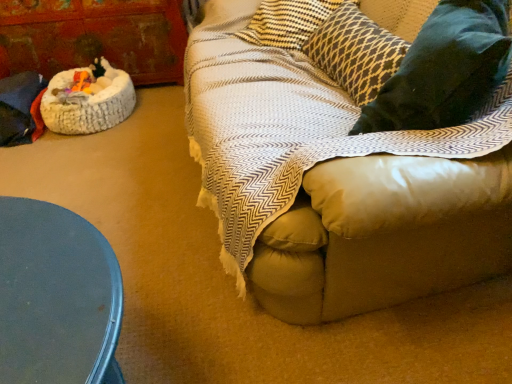
Question: Does dark gray textured pillow at upper right appear on the right side of white fluffy cat bed at left?

Choices:
 (A) yes
 (B) no

Answer: (A)

Question: Does dark gray textured pillow at upper right have a smaller size compared to white fluffy cat bed at left?

Choices:
 (A) no
 (B) yes

Answer: (A)

Question: From a real-world perspective, is dark gray textured pillow at upper right on white fluffy cat bed at left?

Choices:
 (A) no
 (B) yes

Answer: (B)

Question: Is dark gray textured pillow at upper right closer to camera compared to white fluffy cat bed at left?

Choices:
 (A) yes
 (B) no

Answer: (A)

Question: From a real-world perspective, does dark gray textured pillow at upper right sit lower than white fluffy cat bed at left?

Choices:
 (A) yes
 (B) no

Answer: (B)

Question: Is rustic wood armoire at left bigger or smaller than velvety dark green pillow at right?

Choices:
 (A) small
 (B) big

Answer: (B)

Question: Considering the positions of rustic wood armoire at left and velvety dark green pillow at right in the image, is rustic wood armoire at left wider or thinner than velvety dark green pillow at right?

Choices:
 (A) thin
 (B) wide

Answer: (B)

Question: Is rustic wood armoire at left inside or outside of velvety dark green pillow at right?

Choices:
 (A) outside
 (B) inside

Answer: (A)

Question: Is rustic wood armoire at left taller or shorter than velvety dark green pillow at right?

Choices:
 (A) short
 (B) tall

Answer: (A)

Question: Based on their sizes in the image, would you say rustic wood armoire at left is bigger or smaller than white fluffy cat bed at left?

Choices:
 (A) small
 (B) big

Answer: (B)

Question: In terms of width, does rustic wood armoire at left look wider or thinner when compared to white fluffy cat bed at left?

Choices:
 (A) thin
 (B) wide

Answer: (B)

Question: Considering the positions of point pos(19,43) and point pos(115,84), is point pos(19,43) closer or farther from the camera than point pos(115,84)?

Choices:
 (A) farther
 (B) closer

Answer: (A)

Question: Considering their positions, is rustic wood armoire at left located in front of or behind white fluffy cat bed at left?

Choices:
 (A) behind
 (B) front

Answer: (A)

Question: Considering the positions of velvety dark green pillow at right and white fluffy cat bed at left in the image, is velvety dark green pillow at right wider or thinner than white fluffy cat bed at left?

Choices:
 (A) wide
 (B) thin

Answer: (B)

Question: From a real-world perspective, relative to white fluffy cat bed at left, is velvety dark green pillow at right vertically above or below?

Choices:
 (A) below
 (B) above

Answer: (B)